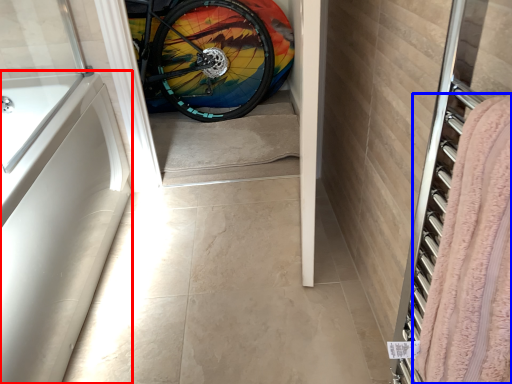
Question: Among these objects, which one is farthest to the camera, bath (highlighted by a red box) or blanket (highlighted by a blue box)?

Choices:
 (A) bath
 (B) blanket

Answer: (A)